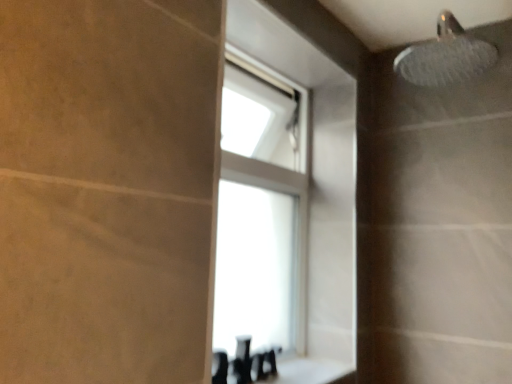
Question: From a real-world perspective, is white glossy counter top at lower center located higher than transparent glass window at upper center?

Choices:
 (A) no
 (B) yes

Answer: (A)

Question: Considering the relative sizes of white glossy counter top at lower center and transparent glass window at upper center in the image provided, is white glossy counter top at lower center wider than transparent glass window at upper center?

Choices:
 (A) no
 (B) yes

Answer: (B)

Question: From the image's perspective, is white glossy counter top at lower center beneath transparent glass window at upper center?

Choices:
 (A) no
 (B) yes

Answer: (B)

Question: Can you confirm if white glossy counter top at lower center is bigger than transparent glass window at upper center?

Choices:
 (A) yes
 (B) no

Answer: (B)

Question: Considering the relative sizes of white glossy counter top at lower center and transparent glass window at upper center in the image provided, is white glossy counter top at lower center taller than transparent glass window at upper center?

Choices:
 (A) yes
 (B) no

Answer: (B)

Question: Is white glossy counter top at lower center outside transparent glass window at upper center?

Choices:
 (A) yes
 (B) no

Answer: (A)

Question: From the image's perspective, would you say transparent glass window at upper center is shown under white glossy counter top at lower center?

Choices:
 (A) yes
 (B) no

Answer: (B)

Question: Is transparent glass window at upper center oriented towards white glossy counter top at lower center?

Choices:
 (A) no
 (B) yes

Answer: (B)

Question: Does transparent glass window at upper center have a smaller size compared to white glossy counter top at lower center?

Choices:
 (A) yes
 (B) no

Answer: (B)

Question: Can we say transparent glass window at upper center lies outside white glossy counter top at lower center?

Choices:
 (A) yes
 (B) no

Answer: (A)

Question: Is white glossy counter top at lower center at the back of transparent glass window at upper center?

Choices:
 (A) yes
 (B) no

Answer: (B)

Question: Does transparent glass window at upper center have a lesser width compared to white glossy counter top at lower center?

Choices:
 (A) no
 (B) yes

Answer: (B)

Question: From the image's perspective, relative to transparent glass window at upper center, is white glossy counter top at lower center above or below?

Choices:
 (A) below
 (B) above

Answer: (A)